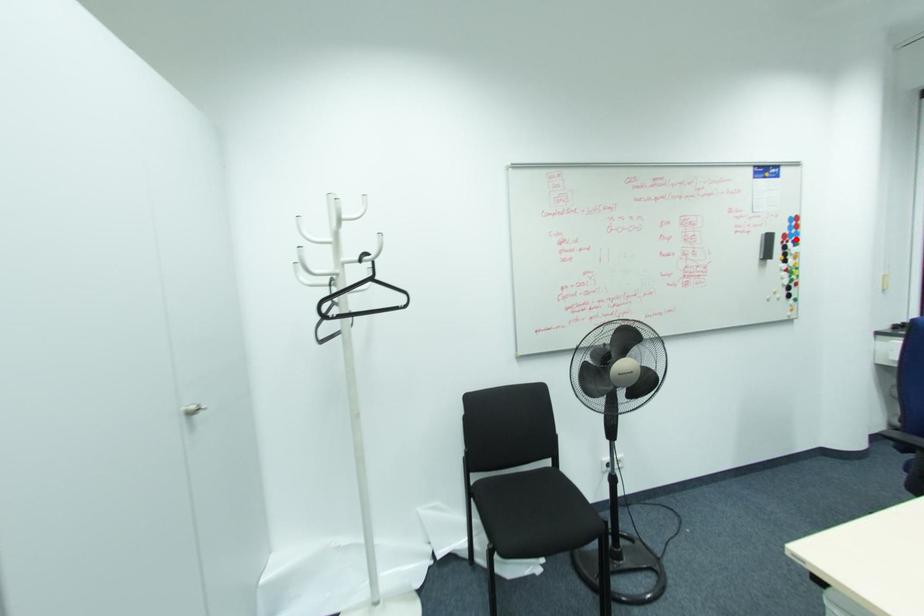
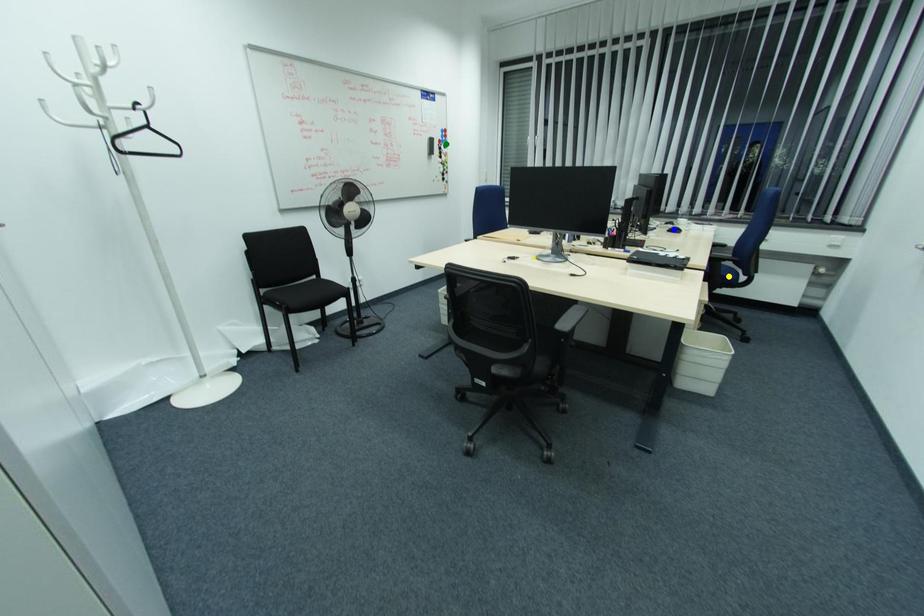
Question: I am providing you with two images of the same scene from different viewpoints. A red point is marked on the first image. You are given multiple points on the second image. Which spot in image 2 lines up with the point in image 1?

Choices:
 (A) blue point
 (B) green point
 (C) yellow point

Answer: (B)